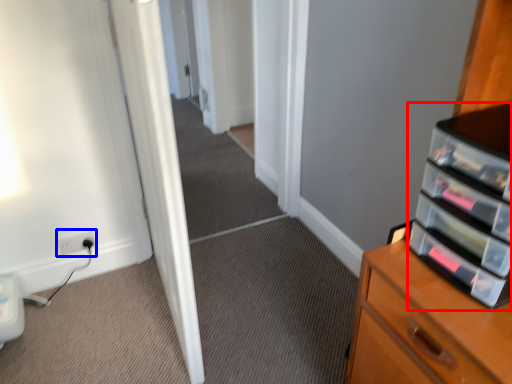
Question: Among these objects, which one is farthest to the camera, shelf (highlighted by a red box) or electric outlet (highlighted by a blue box)?

Choices:
 (A) shelf
 (B) electric outlet

Answer: (B)